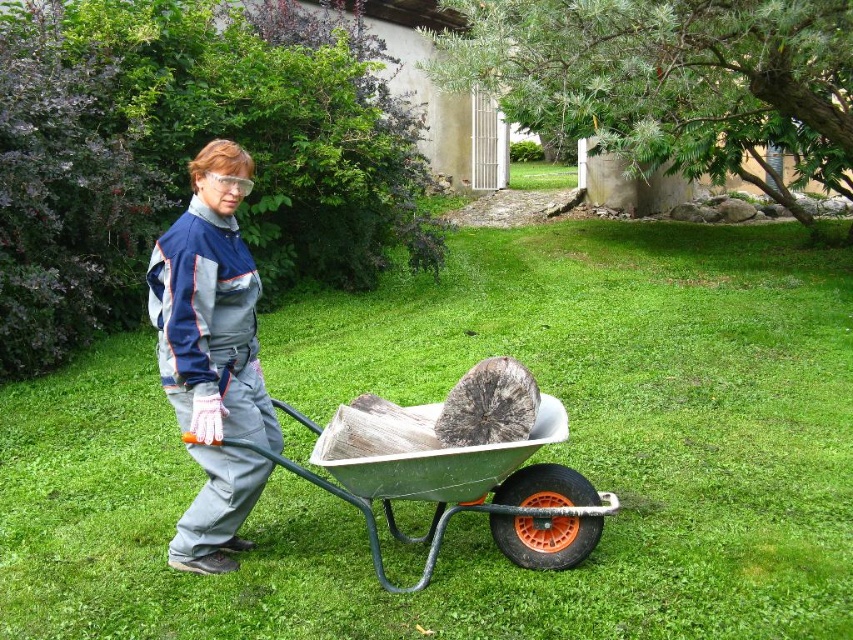
You are a gardener who needs to move the green metallic wheelbarrow at center to the shed located behind the white gate. Considering the green grass at center, will the wheelbarrow fit without damaging the grass?

The green grass at center has a larger size compared to the green metallic wheelbarrow at center, so the wheelbarrow can be moved without damaging the grass as there is enough space.

You are a drone operator trying to capture a photo of the gray fabric jumpsuit at center and the green metallic wheelbarrow at center. Since you need to focus on both objects, which one should you adjust the focus for first?

The gray fabric jumpsuit at center is closer to the viewer than the green metallic wheelbarrow at center, so you should focus on the gray fabric jumpsuit at center first to ensure both are in focus.

You are a delivery person who needs to walk across the area where the green grass at center and gray fabric jumpsuit at center are located. Which object will be under your feet as you step onto the area?

The gray fabric jumpsuit at center is below the green grass at center, so when you step onto the area, the green grass at center will be under your feet.